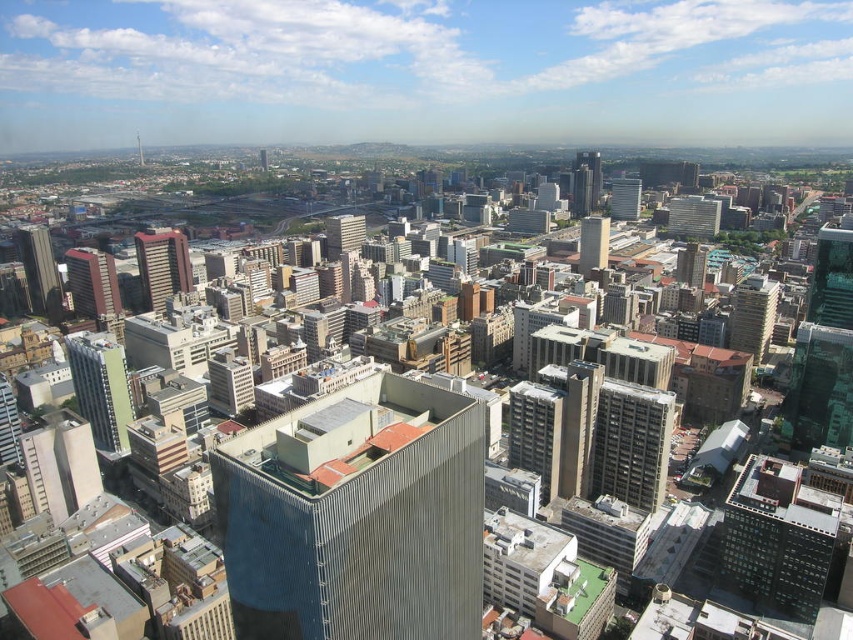
Which of these two, metallic silver skyscraper at center or matte gray skyscraper at center-left, stands taller?

Standing taller between the two is metallic silver skyscraper at center.

Find the location of `metallic silver skyscraper at center`. metallic silver skyscraper at center is located at coordinates (357, 516).

This screenshot has width=853, height=640. What are the coordinates of `metallic silver skyscraper at center` in the screenshot? It's located at (357, 516).

Is matte brown skyscraper at center-left positioned before matte gray skyscraper at left?

Yes, it is.

Identify the location of matte brown skyscraper at center-left. This screenshot has height=640, width=853. (161, 266).

At what (x,y) coordinates should I click in order to perform the action: click on matte brown skyscraper at center-left. Please return your answer as a coordinate pair (x, y). Looking at the image, I should click on (161, 266).

Does matte gray skyscraper at left appear under smooth glass skyscraper at center?

Incorrect, matte gray skyscraper at left is not positioned below smooth glass skyscraper at center.

Does matte gray skyscraper at left have a lesser width compared to smooth glass skyscraper at center?

In fact, matte gray skyscraper at left might be wider than smooth glass skyscraper at center.

Between point (47, 259) and point (578, 269), which one is positioned in front?

Point (47, 259)

Identify the location of matte gray skyscraper at left. (39, 269).